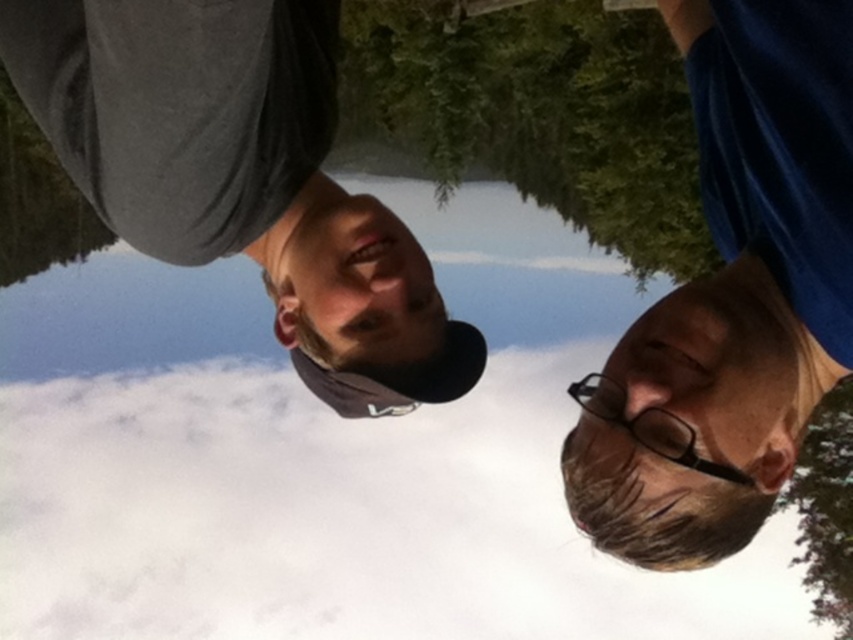
Question: Which point is closer to the camera taking this photo?

Choices:
 (A) (125, 364)
 (B) (636, 422)
 (C) (106, 115)

Answer: (C)

Question: Is matte gray cap at upper left to the right of blue sky at upper center from the viewer's perspective?

Choices:
 (A) no
 (B) yes

Answer: (B)

Question: Among these objects, which one is nearest to the camera?

Choices:
 (A) black plastic glasses at lower right
 (B) blue fabric at right
 (C) blue sky at upper center

Answer: (B)

Question: Which object appears farthest from the camera in this image?

Choices:
 (A) black plastic glasses at lower right
 (B) matte gray cap at upper left
 (C) blue fabric at right

Answer: (A)

Question: Is matte gray cap at upper left to the right of blue fabric at right from the viewer's perspective?

Choices:
 (A) no
 (B) yes

Answer: (A)

Question: Can you confirm if matte gray cap at upper left is positioned below blue fabric at right?

Choices:
 (A) no
 (B) yes

Answer: (A)